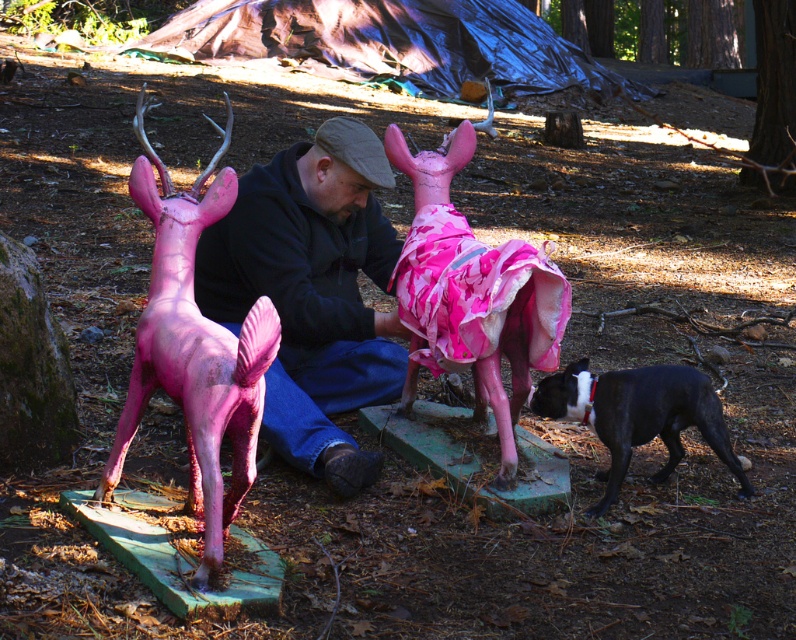
You are a photographer setting up a shot of the scene. You want to ensure both the pink matte deer at center and the black glossy dog at lower right are clearly visible in the frame. Based on their positions, which object should you focus on first to ensure both are in focus?

The pink matte deer at center is in front of the black glossy dog at lower right, so focusing on the pink matte deer at center first will help ensure both are in focus as the dog is behind it.

You are a landscape designer planning to place a new bench in this outdoor area. The bench must be positioned between the matte pink plastic deer at left and the pink matte deer at center. Considering their widths, which deer should the bench be closer to and why?

The bench should be closer to the pink matte deer at center because the matte pink plastic deer at left is wider. Placing the bench closer to the narrower pink matte deer at center will ensure balanced spacing between the two statues.